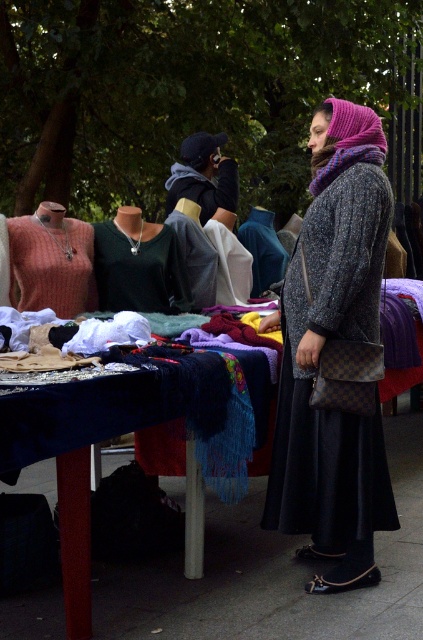
Measure the distance between sparkly gray coat at center and camera.

sparkly gray coat at center and camera are 4.04 meters apart from each other.

Can you confirm if sparkly gray coat at center is positioned to the left of matte black jacket at center?

No, sparkly gray coat at center is not to the left of matte black jacket at center.

Is point (348, 477) less distant than point (225, 161)?

Yes, it is.

Locate an element on the screen. This screenshot has width=423, height=640. sparkly gray coat at center is located at coordinates (329, 349).

Is sparkly gray coat at center wider than knitted wool scarf at center?

Yes, sparkly gray coat at center is wider than knitted wool scarf at center.

What do you see at coordinates (329, 349) in the screenshot? The image size is (423, 640). I see `sparkly gray coat at center` at bounding box center [329, 349].

Who is more forward, (318, 163) or (260, 212)?

Point (318, 163)

This screenshot has height=640, width=423. What are the coordinates of `sparkly gray coat at center` in the screenshot? It's located at (329, 349).

Does knitted coral sweater at left have a larger size compared to matte black jacket at center?

Incorrect, knitted coral sweater at left is not larger than matte black jacket at center.

Which is more to the right, knitted coral sweater at left or matte black jacket at center?

matte black jacket at center is more to the right.

Between point (43, 257) and point (213, 145), which one is positioned in front?

Point (43, 257)

At what (x,y) coordinates should I click in order to perform the action: click on knitted coral sweater at left. Please return your answer as a coordinate pair (x, y). Looking at the image, I should click on (52, 262).